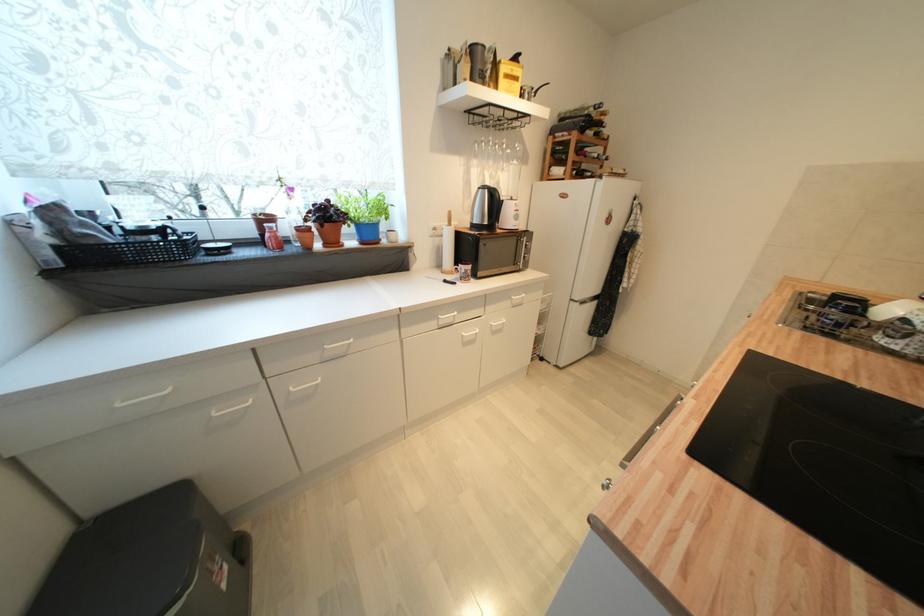
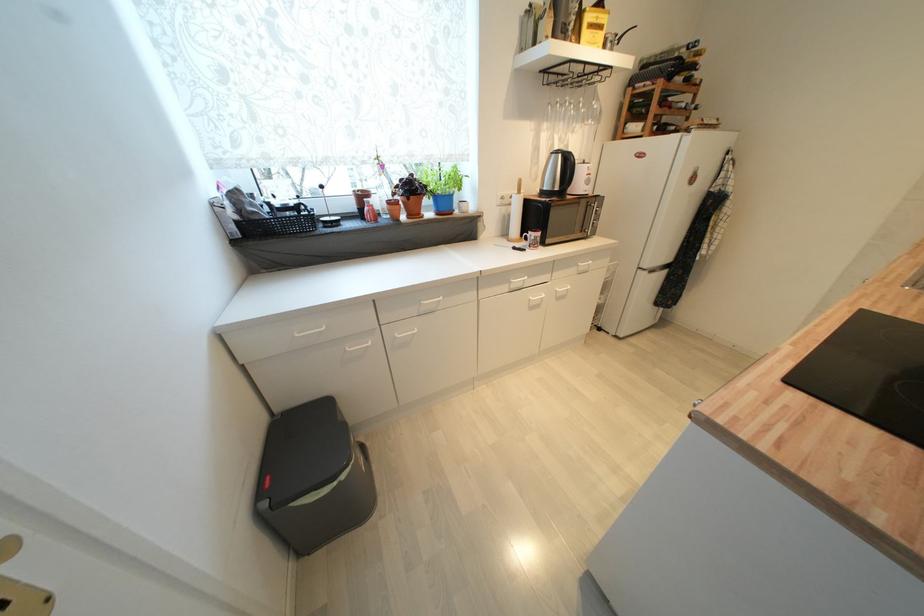
In the second image, find the point that corresponds to [518,304] in the first image.

(585, 270)